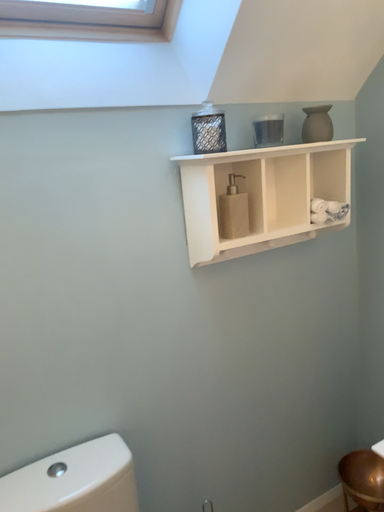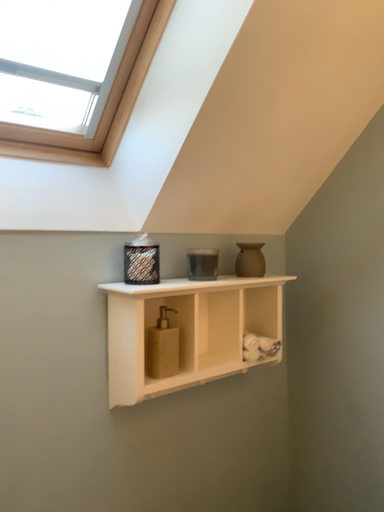
Question: How did the camera likely rotate when shooting the video?

Choices:
 (A) rotated upward
 (B) rotated downward

Answer: (A)